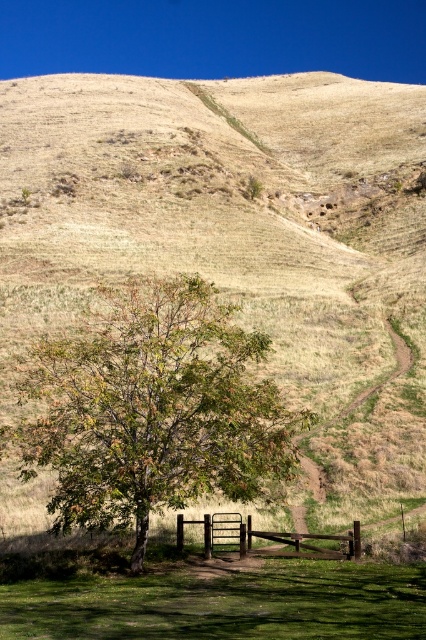
Does green leafy tree at center appear over brown wooden fence at lower center?

Indeed, green leafy tree at center is positioned over brown wooden fence at lower center.

What do you see at coordinates (154, 412) in the screenshot? I see `green leafy tree at center` at bounding box center [154, 412].

Does point (146, 298) lie behind point (181, 531)?

Yes, it is.

The image size is (426, 640). What are the coordinates of `green leafy tree at center` in the screenshot? It's located at (154, 412).

Is green leafy tree at center positioned at the back of green grassy at lower center?

That is True.

You are a GUI agent. You are given a task and a screenshot of the screen. Output one action in this format:
    pyautogui.click(x=<x>, y=<y>)
    Task: Click on the green leafy tree at center
    
    Given the screenshot: What is the action you would take?
    pyautogui.click(x=154, y=412)

This screenshot has width=426, height=640. I want to click on green leafy tree at center, so click(154, 412).

This screenshot has width=426, height=640. What do you see at coordinates (224, 604) in the screenshot? I see `green grassy at lower center` at bounding box center [224, 604].

Consider the image. Which of these two, green grassy at lower center or brown wooden fence at lower center, stands shorter?

brown wooden fence at lower center is shorter.

Is point (307, 582) more distant than point (258, 536)?

No, (307, 582) is closer to viewer.

In order to click on green grassy at lower center in this screenshot , I will do `click(224, 604)`.